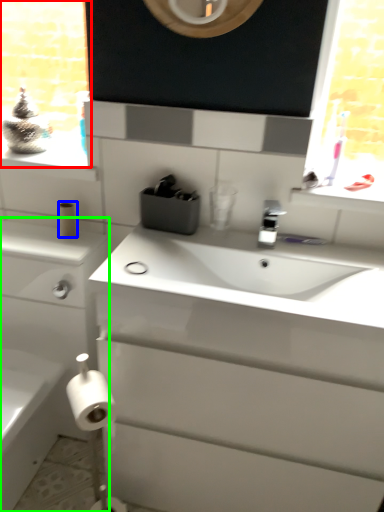
Question: Based on their relative distances, which object is farther from window frame (highlighted by a red box)? Choose from toilet paper (highlighted by a blue box) and bathroom cabinet (highlighted by a green box).

Choices:
 (A) toilet paper
 (B) bathroom cabinet

Answer: (A)